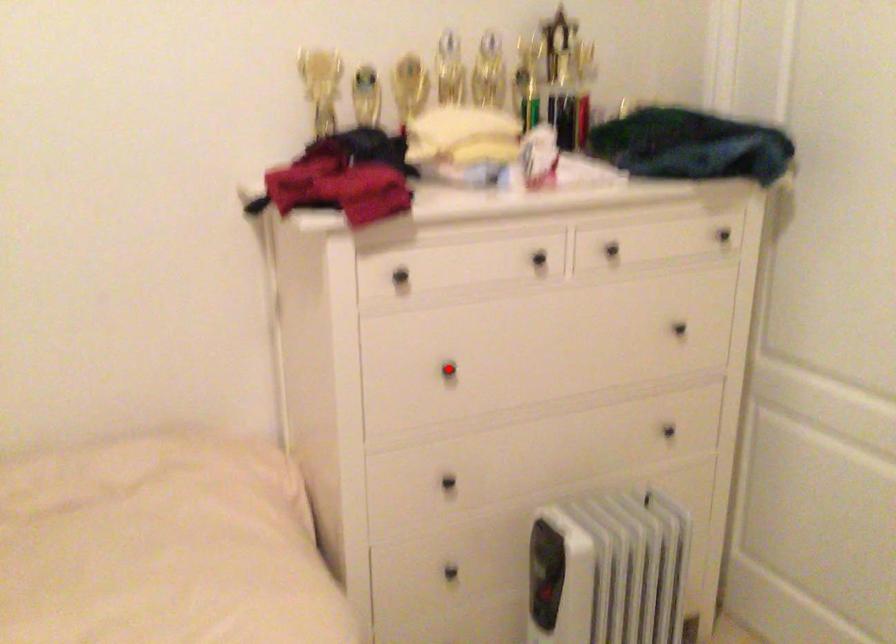
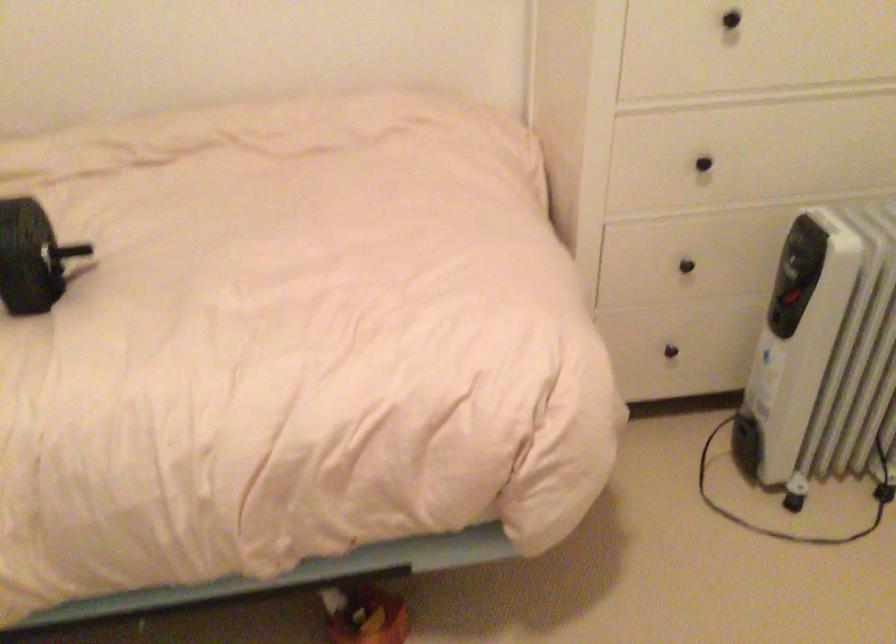
Question: I am providing you with two images of the same scene from different viewpoints. In image1, a red point is highlighted. Considering the same 3D point in image2, which of the following is correct?

Choices:
 (A) It is closer
 (B) It is farther

Answer: (A)